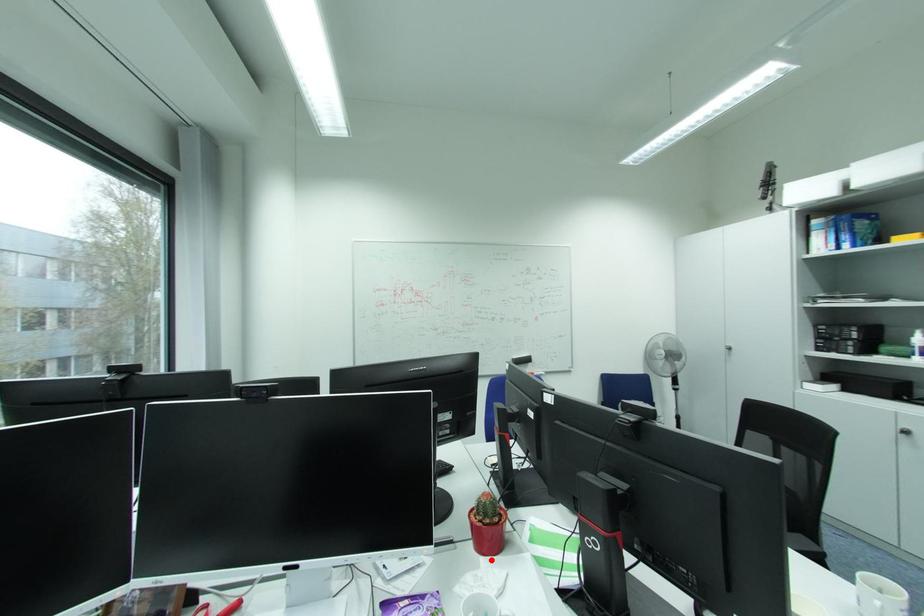
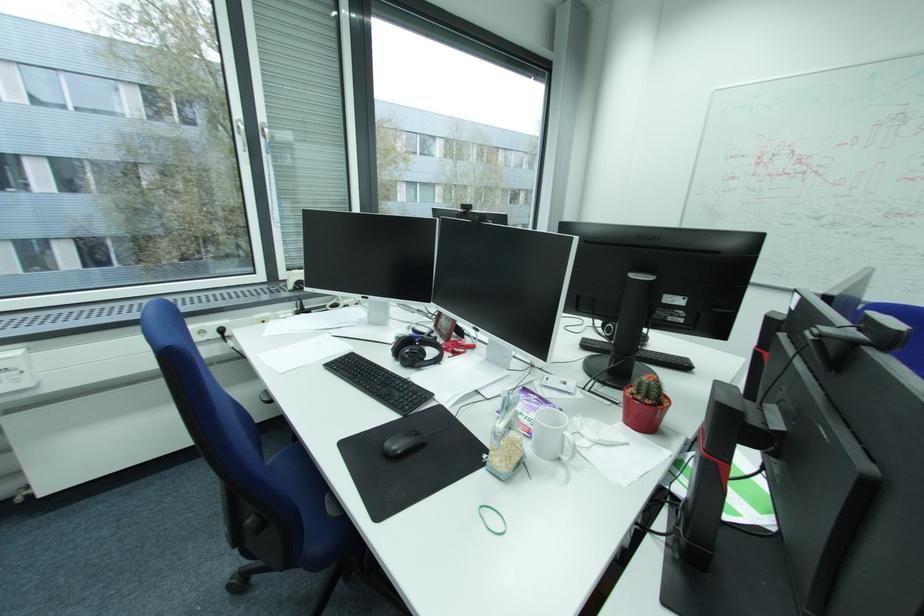
Locate, in the second image, the point that corresponds to the highlighted location in the first image.

(629, 424)